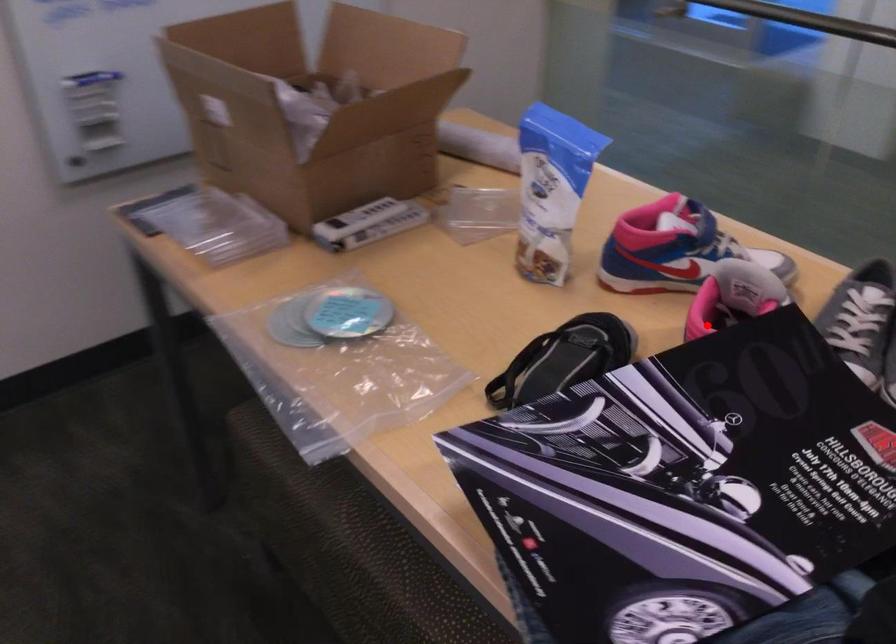
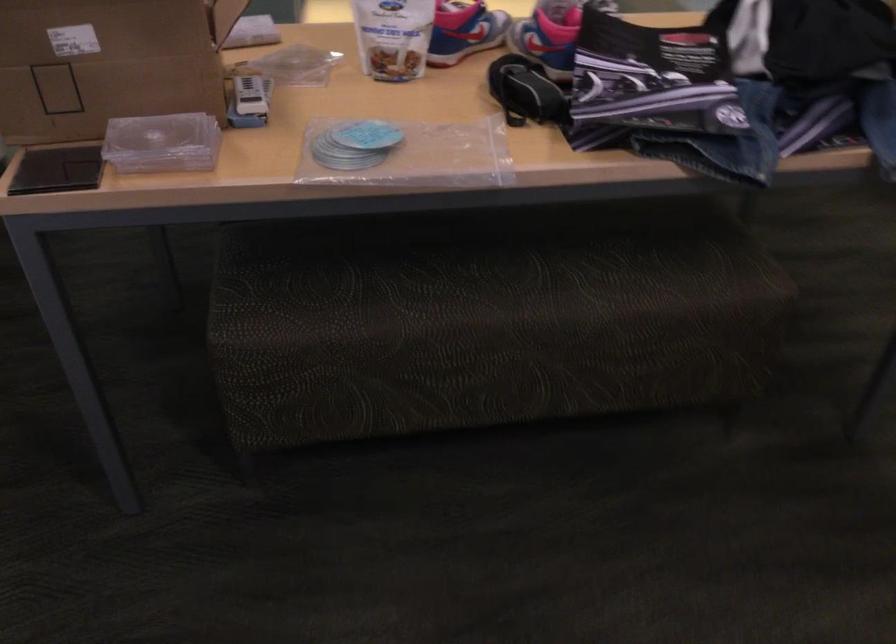
Locate, in the second image, the point that corresponds to the highlighted location in the first image.

(549, 37)